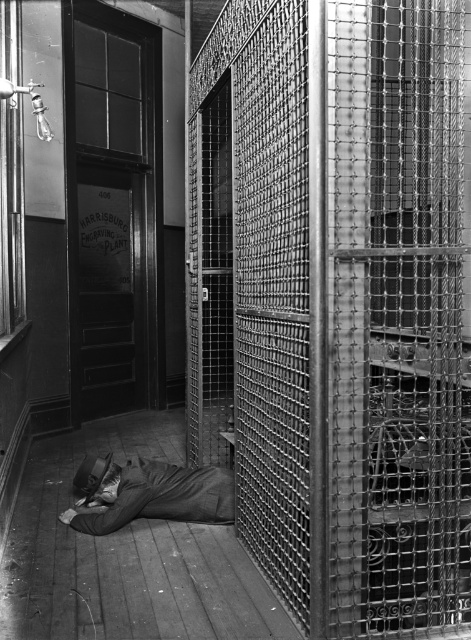
Between point (425, 132) and point (79, 490), which one is positioned in front?

Point (425, 132) is more forward.

Does metal mesh cage at center come behind dark gray fabric at lower center?

No, metal mesh cage at center is in front of dark gray fabric at lower center.

Does point (208, 310) lie behind point (195, 490)?

Yes, it is.

In order to click on metal mesh cage at center in this screenshot , I will do `click(346, 301)`.